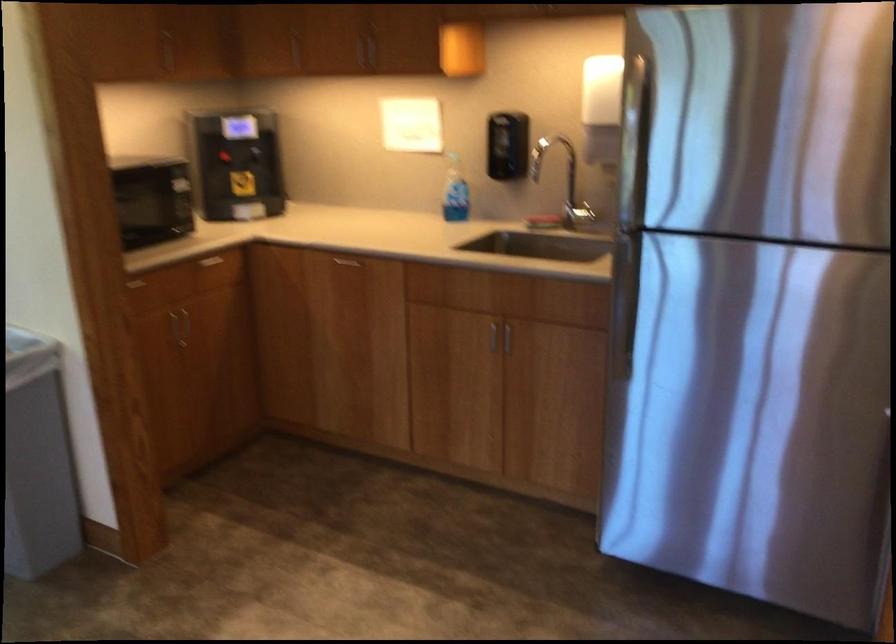
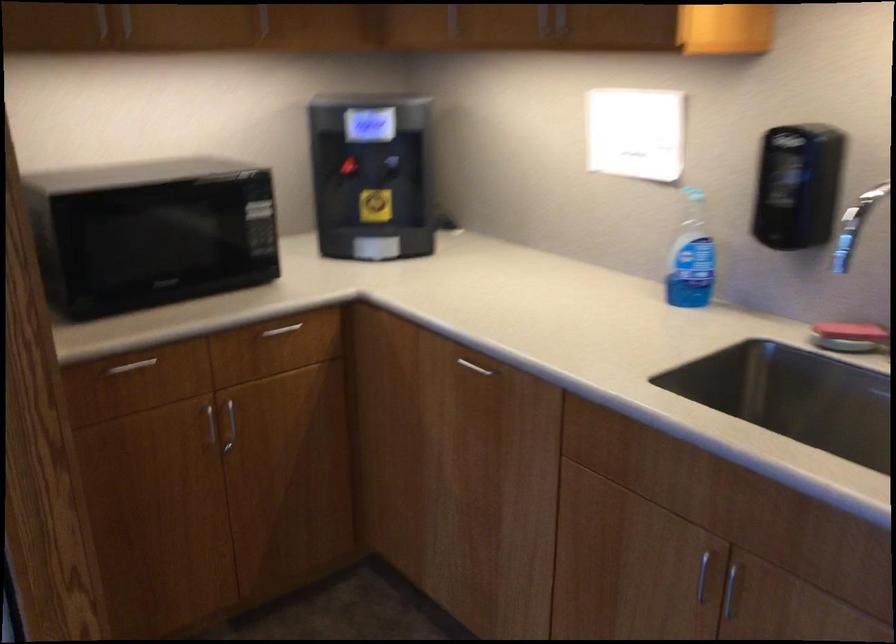
Locate, in the second image, the point that corresponds to the point at 238,161 in the first image.

(372, 176)